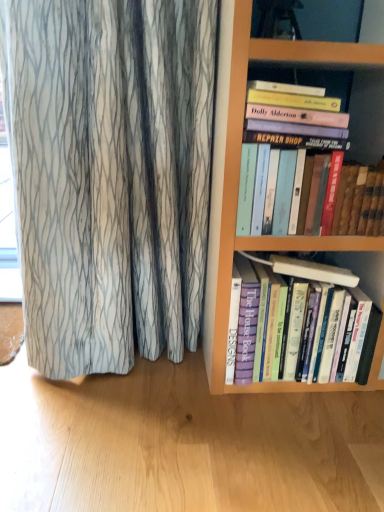
You are a GUI agent. You are given a task and a screenshot of the screen. Output one action in this format:
    pyautogui.click(x=<x>, y=<y>)
    Task: Click on the hardcover books at upper right, marked as the 2th book in a bottom-to-top arrangement
    The width and height of the screenshot is (384, 512).
    Given the screenshot: What is the action you would take?
    pyautogui.click(x=281, y=150)

Describe the element at coordinates (281, 150) in the screenshot. I see `hardcover books at upper right, marked as the 2th book in a bottom-to-top arrangement` at that location.

The width and height of the screenshot is (384, 512). What do you see at coordinates (370, 310) in the screenshot?
I see `purple hardcover book at center, the second book when ordered from top to bottom` at bounding box center [370, 310].

Locate an element on the screen. purple hardcover book at center, the second book when ordered from top to bottom is located at coordinates (370, 310).

How much space does purple hardcover book at center, the second book when ordered from top to bottom, occupy vertically?

The height of purple hardcover book at center, the second book when ordered from top to bottom, is 14.09 inches.

Identify the location of hardcover books at upper right, which is the first book in top-to-bottom order. (281, 150).

Considering the positions of objects hardcover books at upper right, marked as the 2th book in a bottom-to-top arrangement, and purple hardcover book at center, the second book when ordered from top to bottom, in the image provided, who is more to the right, hardcover books at upper right, marked as the 2th book in a bottom-to-top arrangement, or purple hardcover book at center, the second book when ordered from top to bottom,?

hardcover books at upper right, marked as the 2th book in a bottom-to-top arrangement.

Which is in front, hardcover books at upper right, which is the first book in top-to-bottom order, or purple hardcover book at center, the first book positioned from the bottom?

hardcover books at upper right, which is the first book in top-to-bottom order, is in front.

Which is behind, point (344, 121) or point (376, 275)?

The point (376, 275) is farther from the camera.

From the image's perspective, does hardcover books at upper right, marked as the 2th book in a bottom-to-top arrangement, appear higher than purple hardcover book at center, the first book positioned from the bottom?

Correct, hardcover books at upper right, marked as the 2th book in a bottom-to-top arrangement, appears higher than purple hardcover book at center, the first book positioned from the bottom, in the image.

From a real-world perspective, is hardcover books at upper right, marked as the 2th book in a bottom-to-top arrangement, on top of purple hardcover book at center, the second book when ordered from top to bottom?

Yes, from a real-world perspective, hardcover books at upper right, marked as the 2th book in a bottom-to-top arrangement, is over purple hardcover book at center, the second book when ordered from top to bottom

Between hardcover books at upper right, marked as the 2th book in a bottom-to-top arrangement, and purple hardcover book at center, the second book when ordered from top to bottom, which one has larger width?

purple hardcover book at center, the second book when ordered from top to bottom, is wider.

Considering the relative sizes of hardcover books at upper right, marked as the 2th book in a bottom-to-top arrangement, and purple hardcover book at center, the second book when ordered from top to bottom, in the image provided, is hardcover books at upper right, marked as the 2th book in a bottom-to-top arrangement, taller than purple hardcover book at center, the second book when ordered from top to bottom,?

No, hardcover books at upper right, marked as the 2th book in a bottom-to-top arrangement, is not taller than purple hardcover book at center, the second book when ordered from top to bottom.

Considering the sizes of hardcover books at upper right, which is the first book in top-to-bottom order, and purple hardcover book at center, the first book positioned from the bottom, in the image, is hardcover books at upper right, which is the first book in top-to-bottom order, bigger or smaller than purple hardcover book at center, the first book positioned from the bottom,?

In the image, hardcover books at upper right, which is the first book in top-to-bottom order, appears to be smaller than purple hardcover book at center, the first book positioned from the bottom.

Which is correct: hardcover books at upper right, marked as the 2th book in a bottom-to-top arrangement, is inside purple hardcover book at center, the second book when ordered from top to bottom, or outside of it?

hardcover books at upper right, marked as the 2th book in a bottom-to-top arrangement, is not inside purple hardcover book at center, the second book when ordered from top to bottom, it's outside.

Is there a large distance between hardcover books at upper right, marked as the 2th book in a bottom-to-top arrangement, and purple hardcover book at center, the second book when ordered from top to bottom?

hardcover books at upper right, marked as the 2th book in a bottom-to-top arrangement, is near purple hardcover book at center, the second book when ordered from top to bottom, not far away.

Is hardcover books at upper right, marked as the 2th book in a bottom-to-top arrangement, oriented away from purple hardcover book at center, the first book positioned from the bottom?

That's not correct — hardcover books at upper right, marked as the 2th book in a bottom-to-top arrangement, is not looking away from purple hardcover book at center, the first book positioned from the bottom.

Identify the location of book below the hardcover books at upper right, which is the first book in top-to-bottom order (from the image's perspective). The width and height of the screenshot is (384, 512). (370, 310).

Is purple hardcover book at center, the second book when ordered from top to bottom, at the left side of hardcover books at upper right, marked as the 2th book in a bottom-to-top arrangement?

Indeed, purple hardcover book at center, the second book when ordered from top to bottom, is positioned on the left side of hardcover books at upper right, marked as the 2th book in a bottom-to-top arrangement.

Which is in front, purple hardcover book at center, the first book positioned from the bottom, or hardcover books at upper right, which is the first book in top-to-bottom order?

hardcover books at upper right, which is the first book in top-to-bottom order, is in front.

Considering the points (368, 377) and (261, 98), which point is behind, point (368, 377) or point (261, 98)?

The point (368, 377) is farther from the camera.

Consider the image. From the image's perspective, is purple hardcover book at center, the first book positioned from the bottom, on hardcover books at upper right, marked as the 2th book in a bottom-to-top arrangement?

Actually, purple hardcover book at center, the first book positioned from the bottom, appears below hardcover books at upper right, marked as the 2th book in a bottom-to-top arrangement, in the image.

From a real-world perspective, is purple hardcover book at center, the second book when ordered from top to bottom, below hardcover books at upper right, marked as the 2th book in a bottom-to-top arrangement?

Yes.

Based on the photo, which of these two, purple hardcover book at center, the first book positioned from the bottom, or hardcover books at upper right, which is the first book in top-to-bottom order, is wider?

purple hardcover book at center, the first book positioned from the bottom, is wider.

Between purple hardcover book at center, the first book positioned from the bottom, and hardcover books at upper right, which is the first book in top-to-bottom order, which one has more height?

With more height is purple hardcover book at center, the first book positioned from the bottom.

Based on their sizes in the image, would you say purple hardcover book at center, the first book positioned from the bottom, is bigger or smaller than hardcover books at upper right, marked as the 2th book in a bottom-to-top arrangement?

Clearly, purple hardcover book at center, the first book positioned from the bottom, is larger in size than hardcover books at upper right, marked as the 2th book in a bottom-to-top arrangement.

Would you say purple hardcover book at center, the second book when ordered from top to bottom, contains hardcover books at upper right, marked as the 2th book in a bottom-to-top arrangement?

No, hardcover books at upper right, marked as the 2th book in a bottom-to-top arrangement, is not a part of purple hardcover book at center, the second book when ordered from top to bottom.

Is purple hardcover book at center, the second book when ordered from top to bottom, positioned far away from hardcover books at upper right, which is the first book in top-to-bottom order?

No, purple hardcover book at center, the second book when ordered from top to bottom, is not far from hardcover books at upper right, which is the first book in top-to-bottom order.

Could you tell me if purple hardcover book at center, the first book positioned from the bottom, is facing hardcover books at upper right, which is the first book in top-to-bottom order?

No, purple hardcover book at center, the first book positioned from the bottom, does not turn towards hardcover books at upper right, which is the first book in top-to-bottom order.

In the scene shown: What's the angular difference between purple hardcover book at center, the first book positioned from the bottom, and hardcover books at upper right, marked as the 2th book in a bottom-to-top arrangement,'s facing directions?

They differ by 0.000787 degrees in their facing directions.

What are the coordinates of `book behind the hardcover books at upper right, which is the first book in top-to-bottom order` in the screenshot? It's located at (370, 310).

Find the location of a particular element. The image size is (384, 512). book on the left of hardcover books at upper right, which is the first book in top-to-bottom order is located at coordinates (370, 310).

Identify the location of book behind the hardcover books at upper right, which is the first book in top-to-bottom order. (370, 310).